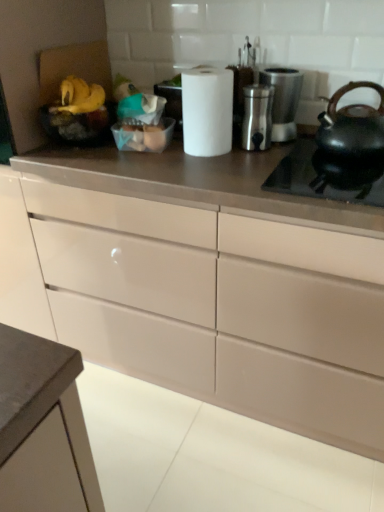
Locate an element on the screen. The image size is (384, 512). free spot in front of translucent plastic eggs at center, arranged as the 2th food when viewed from the left is located at coordinates (147, 160).